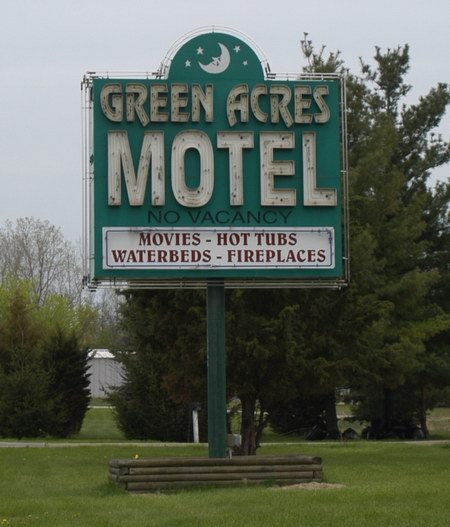
The image size is (450, 527). Identify the location of wooden boards. (186, 472).